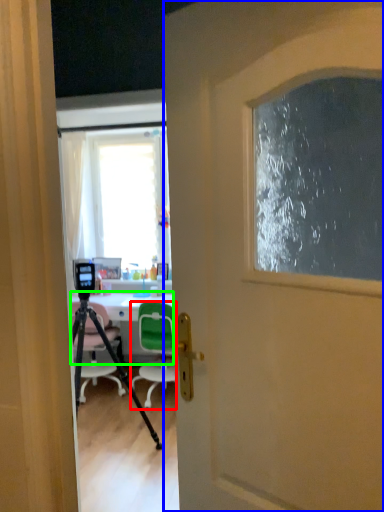
Question: Which object is positioned closest to chair (highlighted by a red box)? Select from door (highlighted by a blue box) and desk (highlighted by a green box).

Choices:
 (A) door
 (B) desk

Answer: (B)